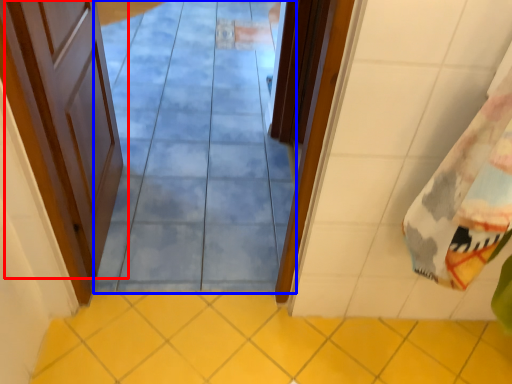
Question: Among these objects, which one is farthest to the camera, door (highlighted by a red box) or path (highlighted by a blue box)?

Choices:
 (A) door
 (B) path

Answer: (A)